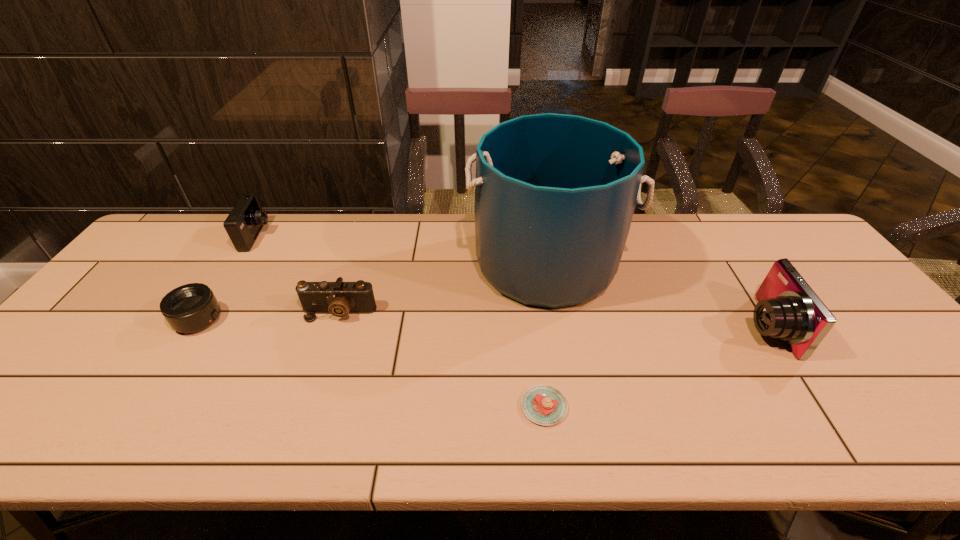
The height and width of the screenshot is (540, 960). I want to click on free area in between the bucket and the nearest object, so click(x=545, y=335).

Identify the location of free point between the rightmost camera and the telephoto lens. Image resolution: width=960 pixels, height=540 pixels. (482, 323).

Identify the location of vacant space that's between the shortest camera and the second shortest object. The width and height of the screenshot is (960, 540). (269, 316).

This screenshot has height=540, width=960. I want to click on free spot between the fifth shortest object and the telephoto lens, so click(482, 323).

I want to click on the third closest object to the second shortest camera, so click(x=555, y=194).

This screenshot has height=540, width=960. What are the coordinates of `object that is the second closest to the bucket` in the screenshot? It's located at click(x=339, y=298).

Point out which camera is positioned as the nearest to the tallest object. Please provide its 2D coordinates. Your answer should be formatted as a tuple, i.e. [(x, y)], where the tuple contains the x and y coordinates of a point satisfying the conditions above.

[(339, 298)]

Where is `the closest camera to the fourth object from right to left`? The width and height of the screenshot is (960, 540). the closest camera to the fourth object from right to left is located at coordinates (244, 223).